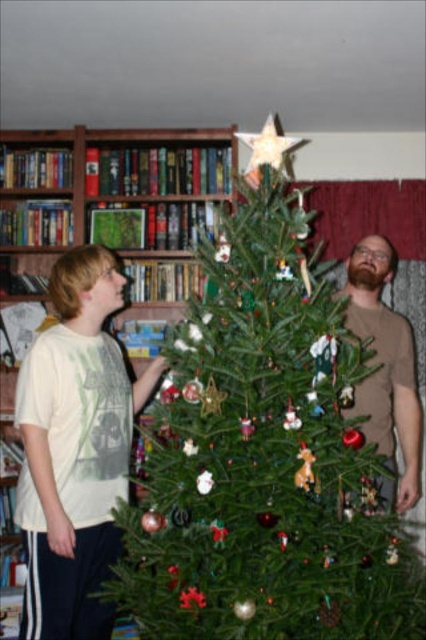
Is green matte bookcase at upper left thinner than white matte t-shirt at left?

Incorrect, green matte bookcase at upper left's width is not less than white matte t-shirt at left's.

Who is positioned more to the left, green matte bookcase at upper left or white matte t-shirt at left?

Positioned to the left is green matte bookcase at upper left.

Which is behind, point (157, 129) or point (92, 413)?

Positioned behind is point (157, 129).

What are the coordinates of `green matte bookcase at upper left` in the screenshot? It's located at [72, 428].

Can you confirm if green natural christmas tree at center is wider than green matte bookcase at upper left?

In fact, green natural christmas tree at center might be narrower than green matte bookcase at upper left.

I want to click on green natural christmas tree at center, so [x=265, y=451].

Does green natural christmas tree at center have a greater width compared to white matte t-shirt at left?

Correct, the width of green natural christmas tree at center exceeds that of white matte t-shirt at left.

Is point (400, 589) positioned before point (140, 384)?

Yes, it is.

Where is `green natural christmas tree at center`? Image resolution: width=426 pixels, height=640 pixels. green natural christmas tree at center is located at coordinates (265, 451).